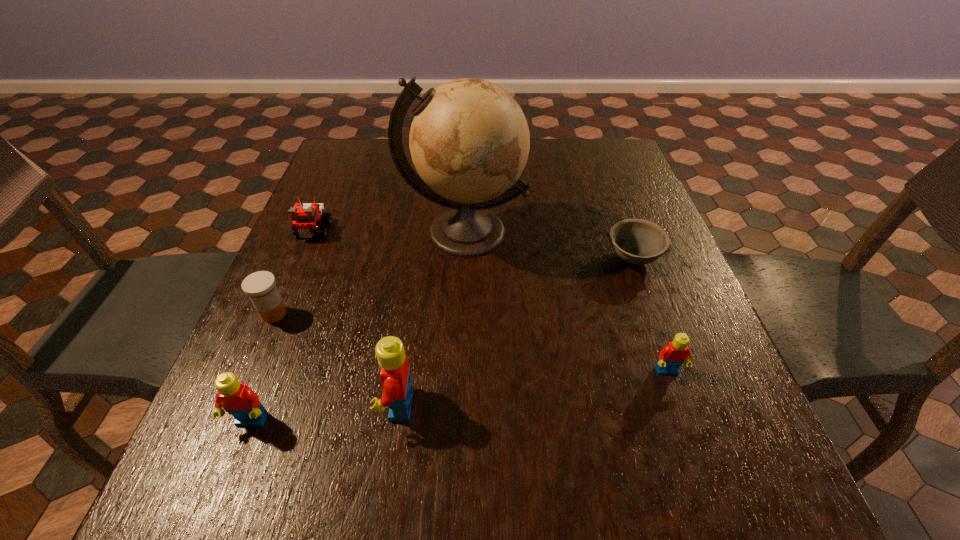
Identify the location of free space that satisfies the following two spatial constraints: 1. on the front-facing side of the farthest Lego; 2. on the left side of the bowl. (301, 258).

Locate an element on the screen. free space in the image that satisfies the following two spatial constraints: 1. on the front-facing side of the tallest object; 2. on the left side of the bowl is located at coordinates (464, 258).

The image size is (960, 540). Identify the location of free point that satisfies the following two spatial constraints: 1. on the front-facing side of the shortest object; 2. on the left side of the farthest Lego. (301, 258).

The width and height of the screenshot is (960, 540). Identify the location of free point that satisfies the following two spatial constraints: 1. on the front-facing side of the farthest Lego; 2. on the label of the fourth nearest object. (278, 314).